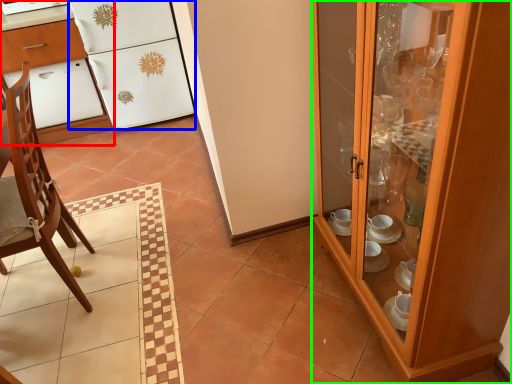
Question: Which is farther away from desk (highlighted by a red box)? refrigerator (highlighted by a blue box) or cabinetry (highlighted by a green box)?

Choices:
 (A) refrigerator
 (B) cabinetry

Answer: (B)